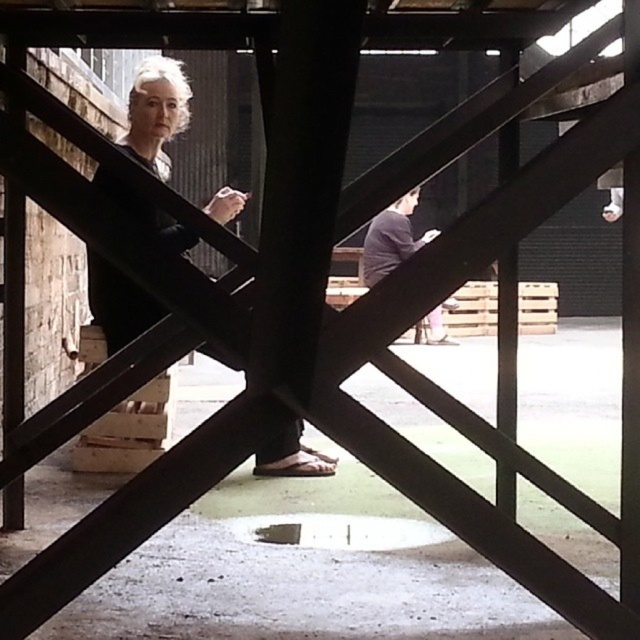
Question: Among these points, which one is nearest to the camera?

Choices:
 (A) (369, 256)
 (B) (118, 460)
 (C) (104, 272)

Answer: (C)

Question: Which point is farther to the camera?

Choices:
 (A) dark brown leather jacket at center
 (B) wooden at lower left
 (C) dark gray sweater at center

Answer: (C)

Question: Which point is farther from the camera taking this photo?

Choices:
 (A) (113, 470)
 (B) (403, 225)

Answer: (B)

Question: Where is dark brown leather jacket at center located in relation to dark gray sweater at center in the image?

Choices:
 (A) right
 (B) left

Answer: (B)

Question: Does wooden at lower left appear over dark gray sweater at center?

Choices:
 (A) no
 (B) yes

Answer: (A)

Question: Observing the image, what is the correct spatial positioning of dark brown leather jacket at center in reference to wooden at lower left?

Choices:
 (A) above
 (B) below

Answer: (A)